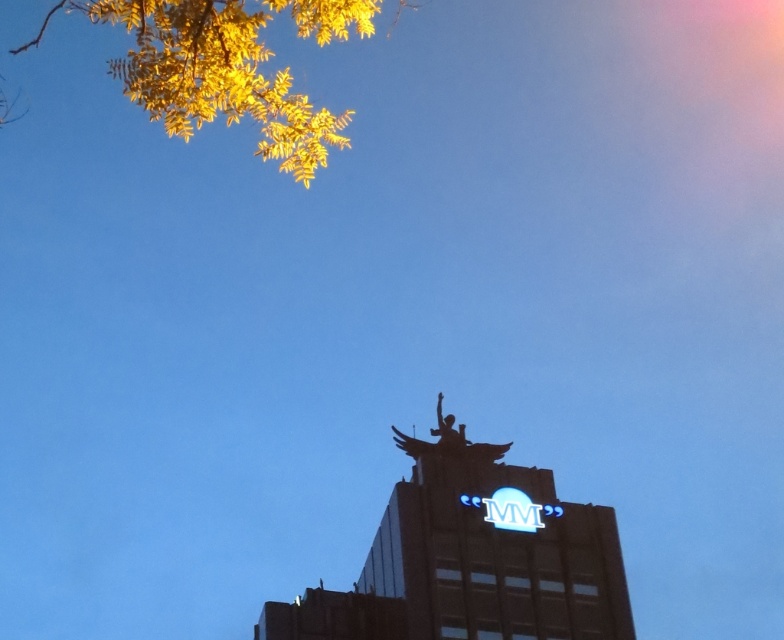
Does metallic statue at center appear under yellow leafy branches at upper left?

Indeed, metallic statue at center is positioned under yellow leafy branches at upper left.

Which of these two, metallic statue at center or yellow leafy branches at upper left, stands shorter?

metallic statue at center

Describe the element at coordinates (472, 557) in the screenshot. I see `metallic statue at center` at that location.

You are a GUI agent. You are given a task and a screenshot of the screen. Output one action in this format:
    pyautogui.click(x=<x>, y=<y>)
    Task: Click on the metallic statue at center
    The image size is (784, 640).
    Given the screenshot: What is the action you would take?
    pyautogui.click(x=472, y=557)